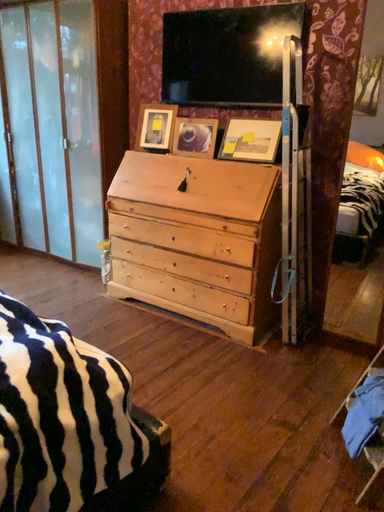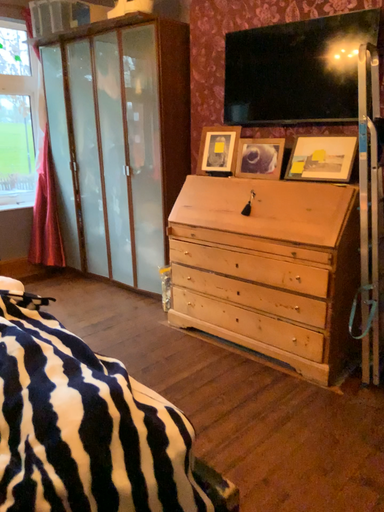
Question: Which way did the camera rotate in the video?

Choices:
 (A) rotated right
 (B) rotated left

Answer: (B)